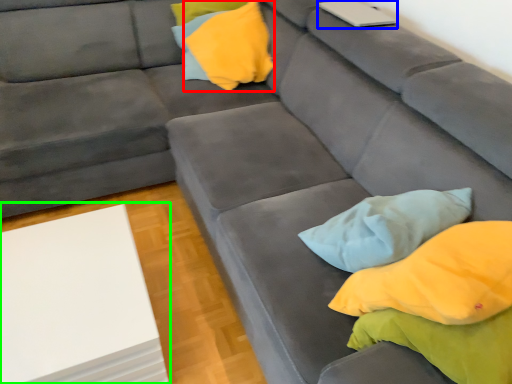
Question: Considering the real-world distances, which object is closest to pillow (highlighted by a red box)? laptop (highlighted by a blue box) or table (highlighted by a green box).

Choices:
 (A) laptop
 (B) table

Answer: (A)